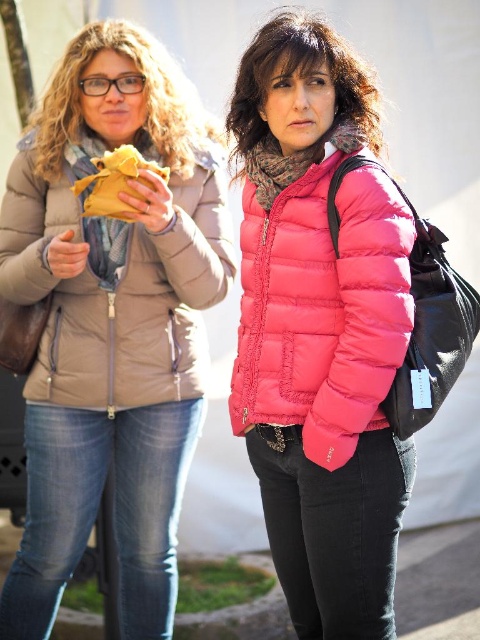
Does matte brown jacket at left have a smaller size compared to pink quilted jacket at center?

Actually, matte brown jacket at left might be larger than pink quilted jacket at center.

Which is above, matte brown jacket at left or pink quilted jacket at center?

Positioned higher is pink quilted jacket at center.

Locate an element on the screen. Image resolution: width=480 pixels, height=640 pixels. matte brown jacket at left is located at coordinates (111, 323).

How far apart are matte brown jacket at left and yellow paper bag at left?

matte brown jacket at left and yellow paper bag at left are 15.68 inches apart from each other.

Is point (163, 534) positioned in front of point (94, 164)?

No, (163, 534) is behind (94, 164).

Identify the location of matte brown jacket at left. The height and width of the screenshot is (640, 480). (111, 323).

In order to click on matte brown jacket at left in this screenshot , I will do `click(111, 323)`.

Is point (141, 291) positioned after point (56, 305)?

Yes, point (141, 291) is behind point (56, 305).

Does matte brown jacket at left have a smaller size compared to matte beige jacket at left?

Incorrect, matte brown jacket at left is not smaller in size than matte beige jacket at left.

Looking at this image, measure the distance between matte brown jacket at left and camera.

A distance of 3.01 meters exists between matte brown jacket at left and camera.

At what (x,y) coordinates should I click in order to perform the action: click on matte brown jacket at left. Please return your answer as a coordinate pair (x, y). Looking at the image, I should click on (111, 323).